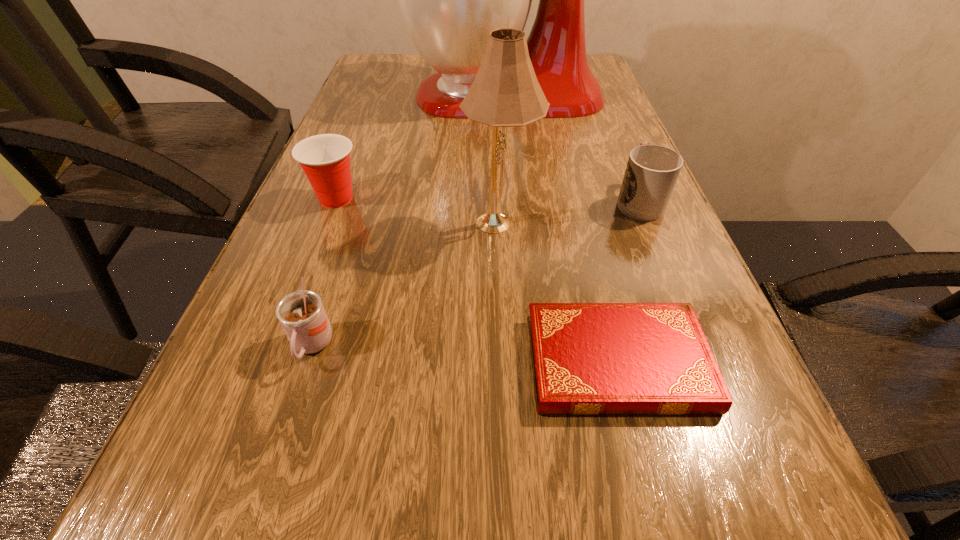
Where is `blank space located 0.290m on the handle side of the rightmost cup`? blank space located 0.290m on the handle side of the rightmost cup is located at coordinates (605, 119).

Where is `vacant area situated 0.110m on the handle side of the rightmost cup`? The width and height of the screenshot is (960, 540). vacant area situated 0.110m on the handle side of the rightmost cup is located at coordinates (619, 155).

What are the coordinates of `free space located 0.150m on the handle side of the rightmost cup` in the screenshot? It's located at (616, 146).

Identify the location of free region located on the side with the handle of the nearest cup. Image resolution: width=960 pixels, height=540 pixels. (271, 475).

Where is `vacant region located 0.280m on the cover of the shortest object`? The width and height of the screenshot is (960, 540). vacant region located 0.280m on the cover of the shortest object is located at coordinates (339, 362).

Identify the location of free space located 0.230m on the cover of the shortest object. (373, 362).

Locate an element on the screen. This screenshot has width=960, height=540. vacant space situated on the cover of the shortest object is located at coordinates (339, 362).

You are a GUI agent. You are given a task and a screenshot of the screen. Output one action in this format:
    pyautogui.click(x=<x>, y=<y>)
    Task: Click on the object at the far edge
    
    Given the screenshot: What is the action you would take?
    click(450, 0)

Find the location of a particular element. mixer that is positioned at the right edge is located at coordinates (450, 0).

Find the location of a particular element. The height and width of the screenshot is (540, 960). cup situated at the right edge is located at coordinates tap(652, 171).